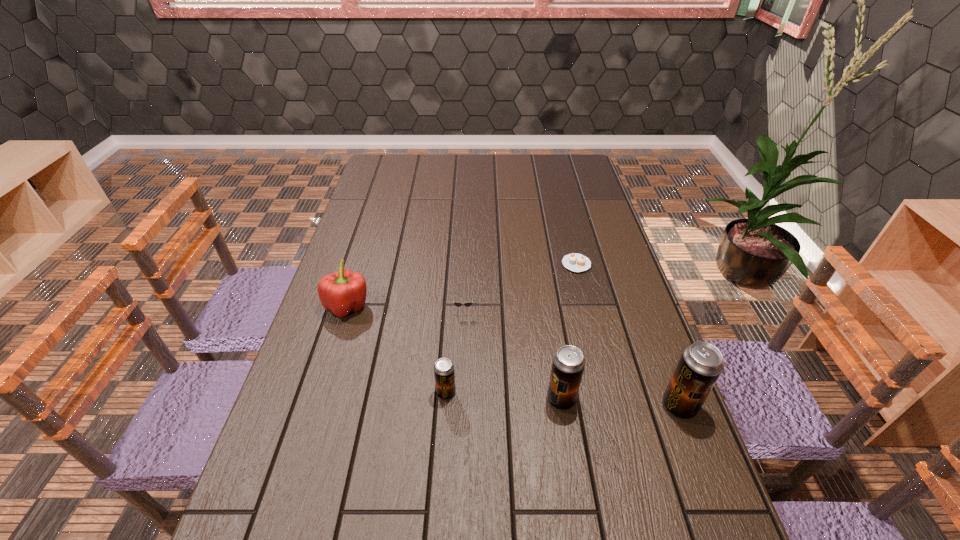
This screenshot has width=960, height=540. What are the coordinates of `vacant region at the right edge` in the screenshot? It's located at (612, 403).

You are a GUI agent. You are given a task and a screenshot of the screen. Output one action in this format:
    pyautogui.click(x=<x>, y=<y>)
    Task: Click on the blank space at the near right corner of the desktop
    The height and width of the screenshot is (540, 960).
    Given the screenshot: What is the action you would take?
    pyautogui.click(x=698, y=514)

Identify the location of vacant area that lies between the bell pepper and the shortest beer can. (396, 349).

The image size is (960, 540). Identify the location of free space between the fifth shortest object and the sunglasses. (513, 354).

Where is `free spot between the second beer can from right to left and the rightmost object`? This screenshot has width=960, height=540. free spot between the second beer can from right to left and the rightmost object is located at coordinates (620, 403).

This screenshot has width=960, height=540. In order to click on free area in between the bell pepper and the second shortest object in this screenshot , I will do `click(406, 307)`.

The width and height of the screenshot is (960, 540). I want to click on vacant point located between the fifth shortest object and the cupcake, so click(x=568, y=332).

Locate an element on the screen. vacant region between the second shortest object and the shortest beer can is located at coordinates (455, 351).

I want to click on free spot between the bell pepper and the fourth object from left to right, so click(x=454, y=353).

You are a GUI agent. You are given a task and a screenshot of the screen. Output one action in this format:
    pyautogui.click(x=<x>, y=<y>)
    Task: Click on the free point between the sunglasses and the shortest object
    
    Given the screenshot: What is the action you would take?
    pyautogui.click(x=520, y=287)